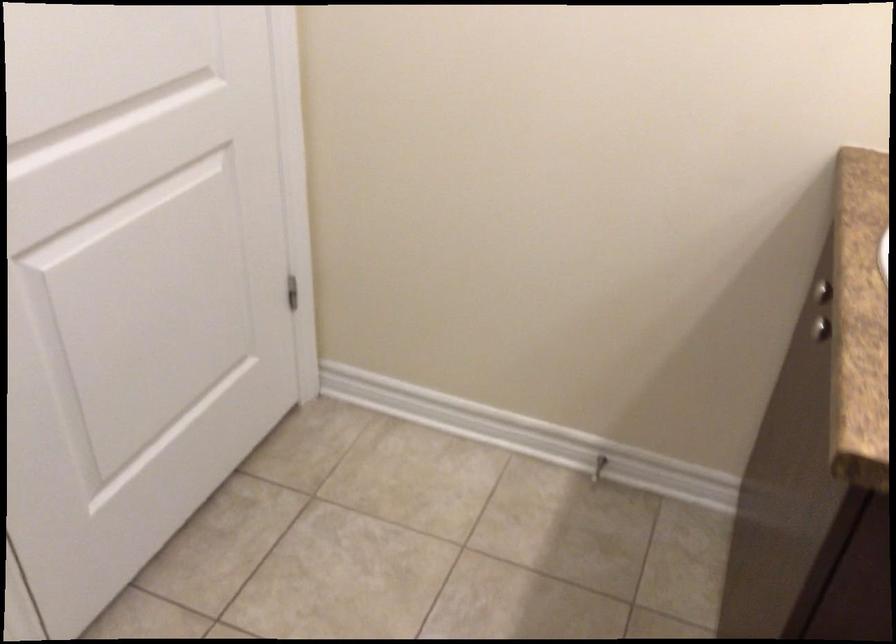
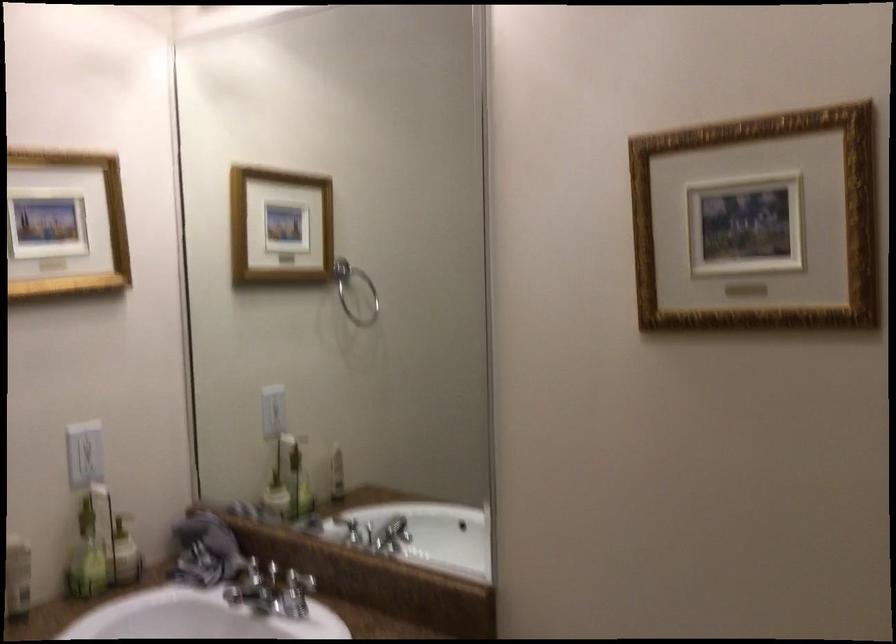
Question: The first image is from the beginning of the video and the second image is from the end. How did the camera likely rotate when shooting the video?

Choices:
 (A) Left
 (B) Right
 (C) Up
 (D) Down

Answer: (B)